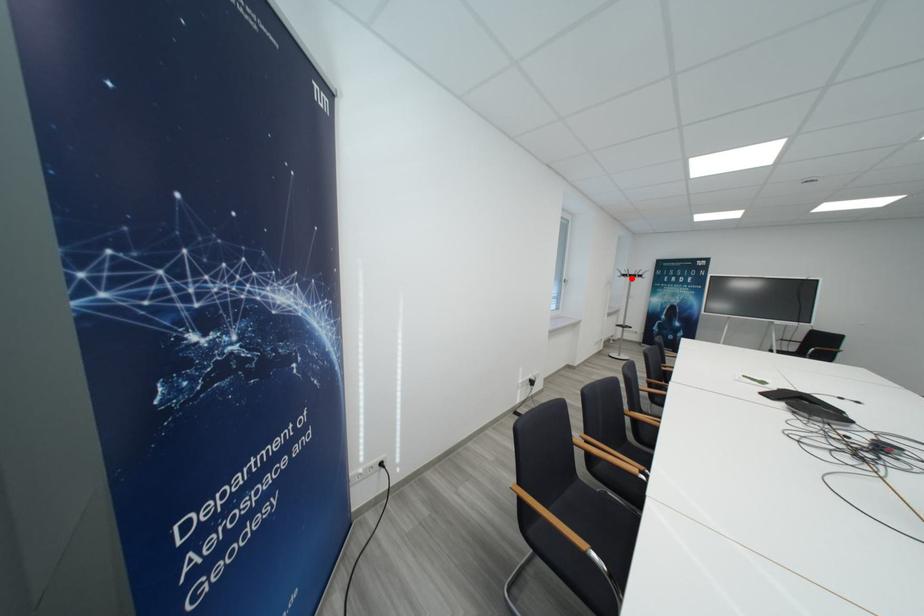
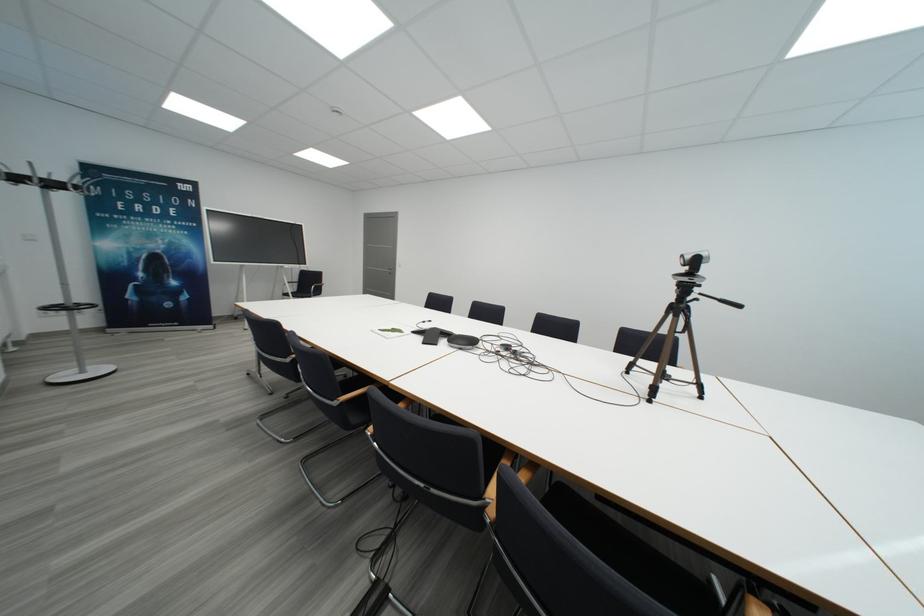
Locate, in the second image, the point that corresponds to the highlighted location in the first image.

(21, 180)